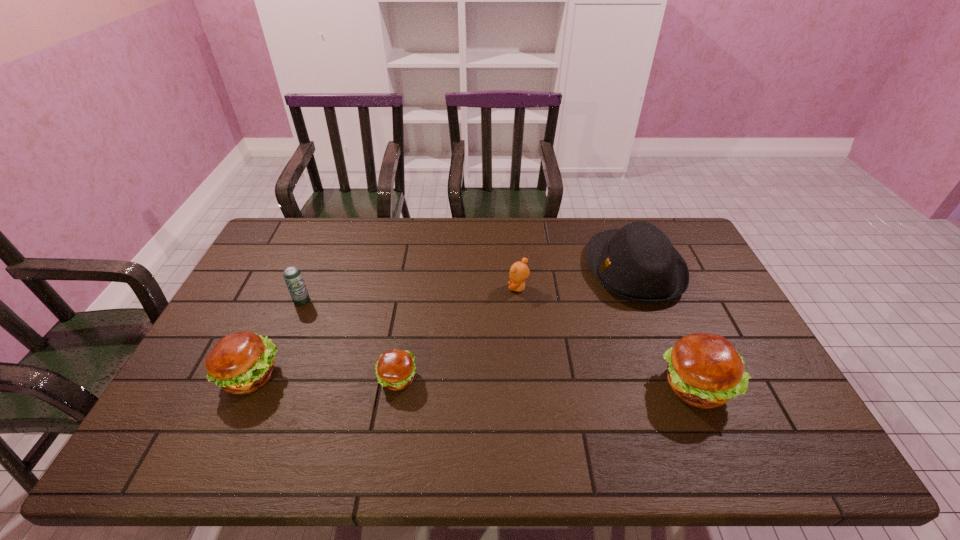
Identify the location of free space for an extra hamburger to achieve even spacing. (545, 382).